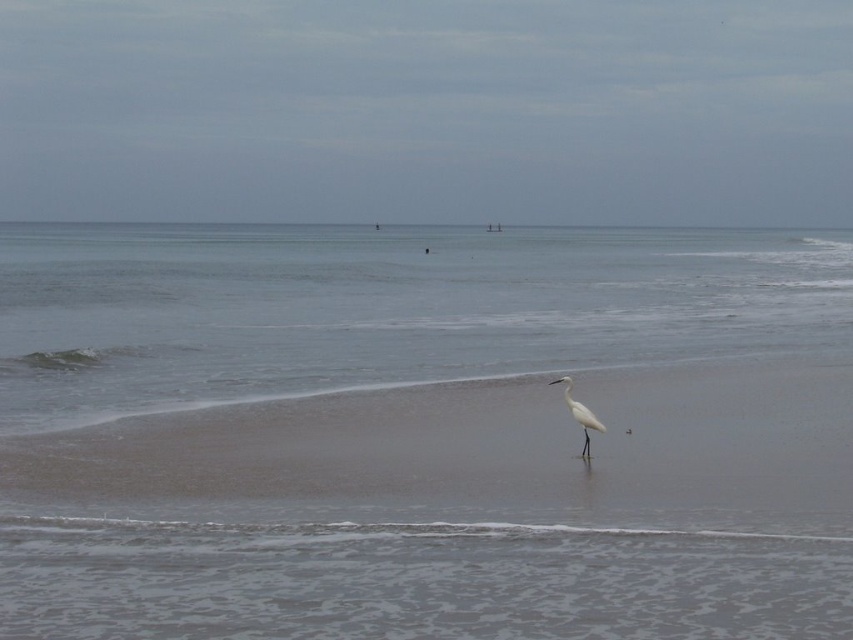
Is clear water at center to the left of smooth sand at center from the viewer's perspective?

Yes, clear water at center is to the left of smooth sand at center.

Between clear water at center and smooth sand at center, which one has more height?

With more height is clear water at center.

Does point (157, 582) come closer to viewer compared to point (573, 515)?

Yes.

The width and height of the screenshot is (853, 640). I want to click on clear water at center, so click(x=422, y=433).

Does clear water at center lie behind white matte bird at center?

No.

Is point (273, 365) positioned in front of point (595, 424)?

No, (273, 365) is further to viewer.

Locate an element on the screen. clear water at center is located at coordinates (422, 433).

Which is more to the right, smooth sand at center or white matte bird at center?

From the viewer's perspective, white matte bird at center appears more on the right side.

From the picture: Between smooth sand at center and white matte bird at center, which one has more height?

Standing taller between the two is smooth sand at center.

Measure the distance between smooth sand at center and camera.

They are 35.34 feet apart.

Locate an element on the screen. smooth sand at center is located at coordinates (482, 449).